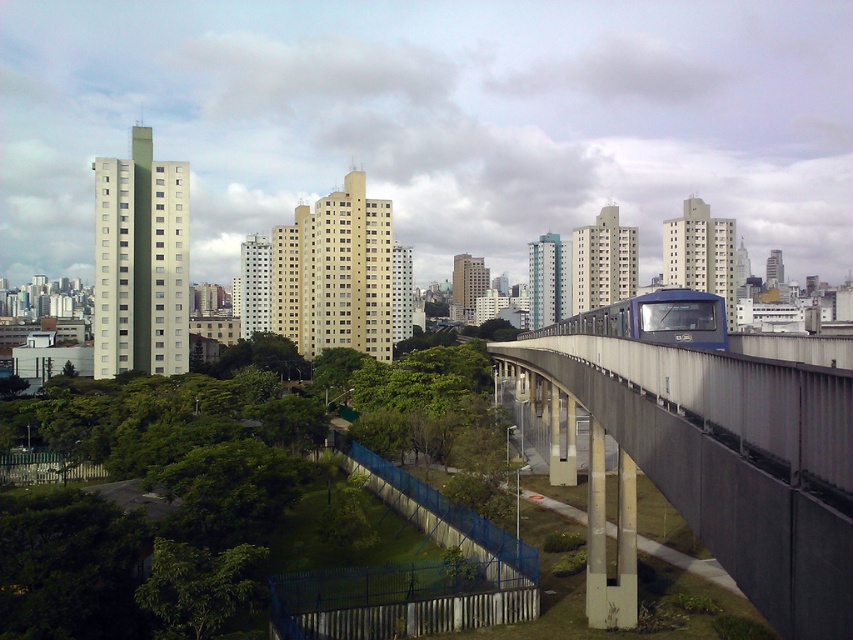
Does concrete bridge at right appear over blue metallic train at center?

No, concrete bridge at right is not above blue metallic train at center.

Looking at this image, can you confirm if concrete bridge at right is positioned to the left of blue metallic train at center?

Correct, you'll find concrete bridge at right to the left of blue metallic train at center.

Who is more distant from viewer, (844, 477) or (549, 326)?

The point (549, 326) is more distant.

The width and height of the screenshot is (853, 640). I want to click on concrete bridge at right, so click(730, 460).

Is green leafy tree at center in front of blue metallic train at center?

No, it is behind blue metallic train at center.

How distant is green leafy tree at center from blue metallic train at center?

green leafy tree at center and blue metallic train at center are 75.98 feet apart.

Who is more forward, (132, 580) or (614, 308)?

Positioned in front is point (132, 580).

You are a GUI agent. You are given a task and a screenshot of the screen. Output one action in this format:
    pyautogui.click(x=<x>, y=<y>)
    Task: Click on the green leafy tree at center
    The width and height of the screenshot is (853, 640).
    Given the screenshot: What is the action you would take?
    pyautogui.click(x=216, y=518)

Which is in front, point (90, 580) or point (691, 509)?

Point (691, 509)

Who is shorter, green leafy tree at center or concrete bridge at right?

concrete bridge at right

Where is `green leafy tree at center`? This screenshot has width=853, height=640. green leafy tree at center is located at coordinates (216, 518).